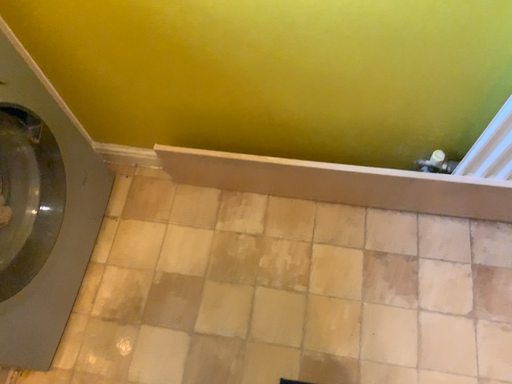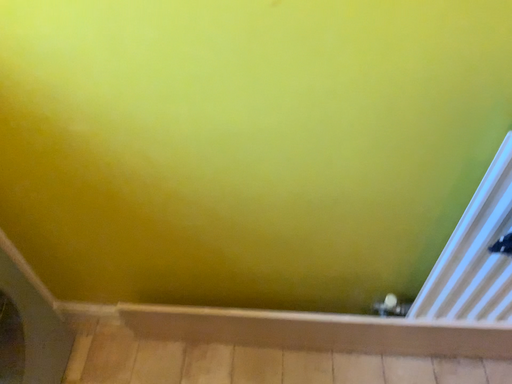
Question: Which way did the camera rotate in the video?

Choices:
 (A) rotated downward
 (B) rotated upward

Answer: (B)